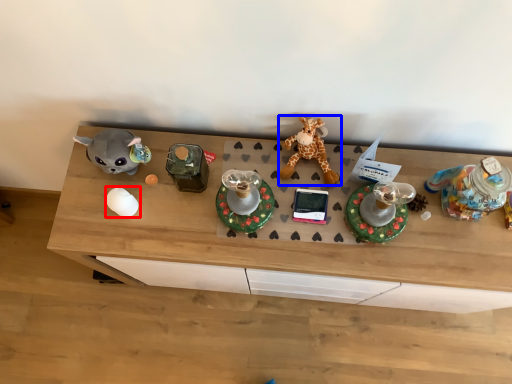
Question: Which object appears farthest to the camera in this image, toy (highlighted by a red box) or giraffe (highlighted by a blue box)?

Choices:
 (A) toy
 (B) giraffe

Answer: (A)